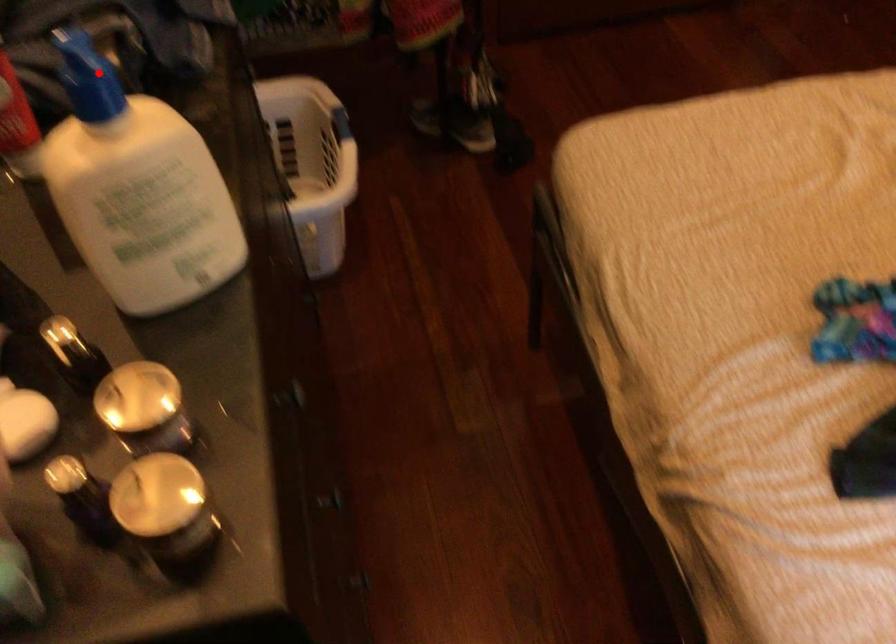
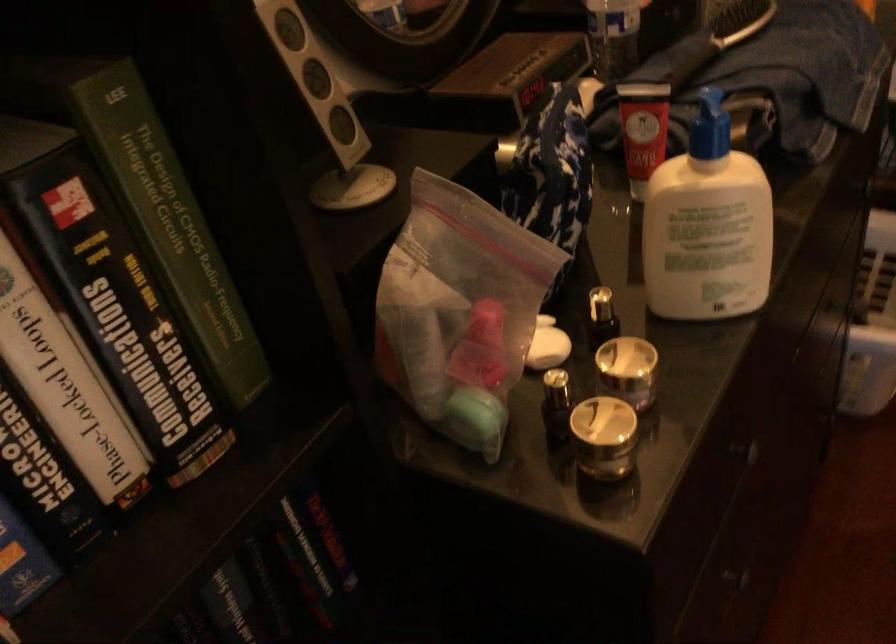
Locate, in the second image, the point that corresponds to the highlighted location in the first image.

(709, 126)